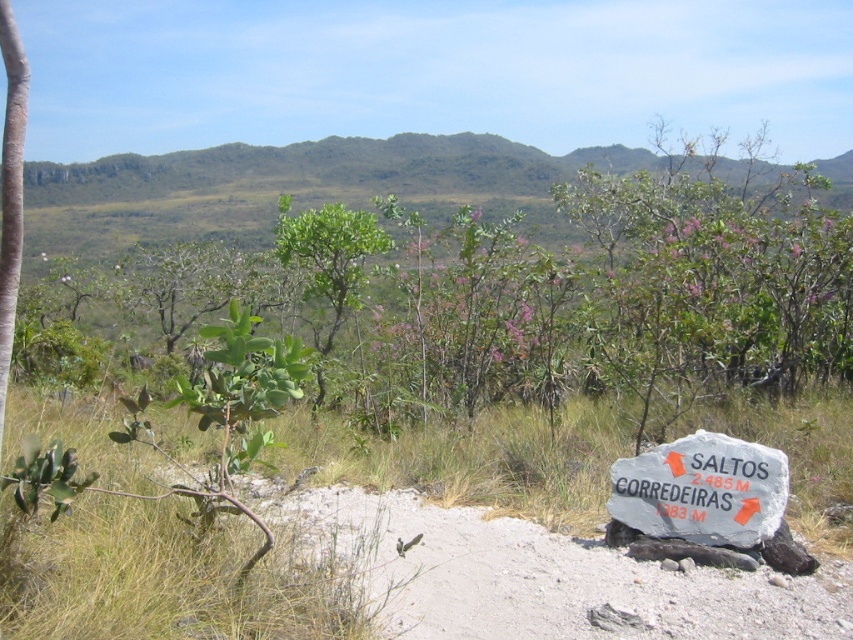
Based on the photo, is green leafy tree at center above gray stone sign at lower right?

Yes.

Between point (363, 150) and point (659, 470), which one is positioned in front?

Point (659, 470)

This screenshot has width=853, height=640. Find the location of `green leafy tree at center`. green leafy tree at center is located at coordinates (289, 177).